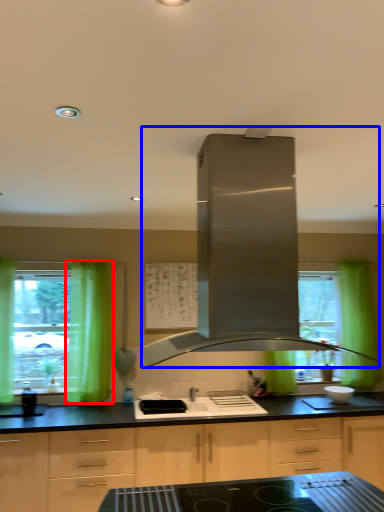
Question: Among these objects, which one is nearest to the camera, curtain (highlighted by a red box) or home appliance (highlighted by a blue box)?

Choices:
 (A) curtain
 (B) home appliance

Answer: (B)